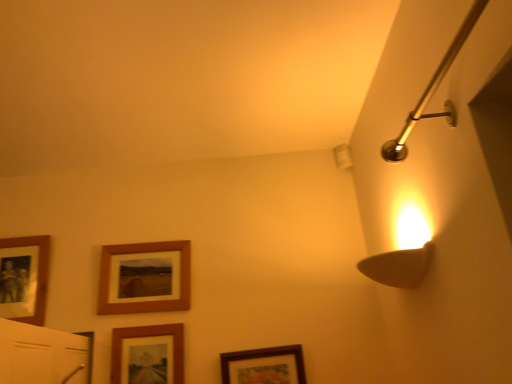
Question: Is polished brass shower arm at upper right surrounded by wooden photo frame at left, acting as the fourth picture frame starting from the right?

Choices:
 (A) no
 (B) yes

Answer: (A)

Question: Considering the relative positions of wooden photo frame at left, acting as the fourth picture frame starting from the right, and polished brass shower arm at upper right in the image provided, is wooden photo frame at left, acting as the fourth picture frame starting from the right, to the right of polished brass shower arm at upper right from the viewer's perspective?

Choices:
 (A) no
 (B) yes

Answer: (A)

Question: Considering the relative sizes of wooden photo frame at left, acting as the fourth picture frame starting from the right, and polished brass shower arm at upper right in the image provided, is wooden photo frame at left, acting as the fourth picture frame starting from the right, shorter than polished brass shower arm at upper right?

Choices:
 (A) yes
 (B) no

Answer: (B)

Question: Is wooden photo frame at left, the 1th picture frame positioned from the left, completely or partially outside of polished brass shower arm at upper right?

Choices:
 (A) no
 (B) yes

Answer: (B)

Question: Does wooden photo frame at left, the 1th picture frame positioned from the left, have a greater width compared to polished brass shower arm at upper right?

Choices:
 (A) no
 (B) yes

Answer: (A)

Question: Considering the relative sizes of wooden photo frame at left, acting as the fourth picture frame starting from the right, and polished brass shower arm at upper right in the image provided, is wooden photo frame at left, acting as the fourth picture frame starting from the right, bigger than polished brass shower arm at upper right?

Choices:
 (A) no
 (B) yes

Answer: (A)

Question: Is the depth of wooden framed picture at lower center, placed as the 4th picture frame when sorted from left to right, greater than that of wooden framed picture at lower center, arranged as the 3th picture frame when viewed from the left?

Choices:
 (A) no
 (B) yes

Answer: (A)

Question: From the image's perspective, would you say wooden framed picture at lower center, placed as the 4th picture frame when sorted from left to right, is shown under wooden framed picture at lower center, arranged as the 3th picture frame when viewed from the left?

Choices:
 (A) no
 (B) yes

Answer: (B)

Question: Is wooden framed picture at lower center, placed as the first picture frame when sorted from right to left, positioned beyond the bounds of wooden framed picture at lower center, arranged as the 2th picture frame when viewed from the right?

Choices:
 (A) yes
 (B) no

Answer: (A)

Question: From a real-world perspective, is wooden framed picture at lower center, placed as the first picture frame when sorted from right to left, on wooden framed picture at lower center, arranged as the 3th picture frame when viewed from the left?

Choices:
 (A) no
 (B) yes

Answer: (A)

Question: Does wooden framed picture at lower center, placed as the first picture frame when sorted from right to left, have a greater height compared to wooden framed picture at lower center, arranged as the 2th picture frame when viewed from the right?

Choices:
 (A) no
 (B) yes

Answer: (A)

Question: Is wooden framed picture at lower center, placed as the 4th picture frame when sorted from left to right, at the right side of wooden framed picture at lower center, arranged as the 3th picture frame when viewed from the left?

Choices:
 (A) yes
 (B) no

Answer: (A)

Question: Is wooden framed picture at lower center, arranged as the 2th picture frame when viewed from the right, completely or partially inside wooden picture frame at center, which ranks as the 3th picture frame in right-to-left order?

Choices:
 (A) no
 (B) yes

Answer: (A)